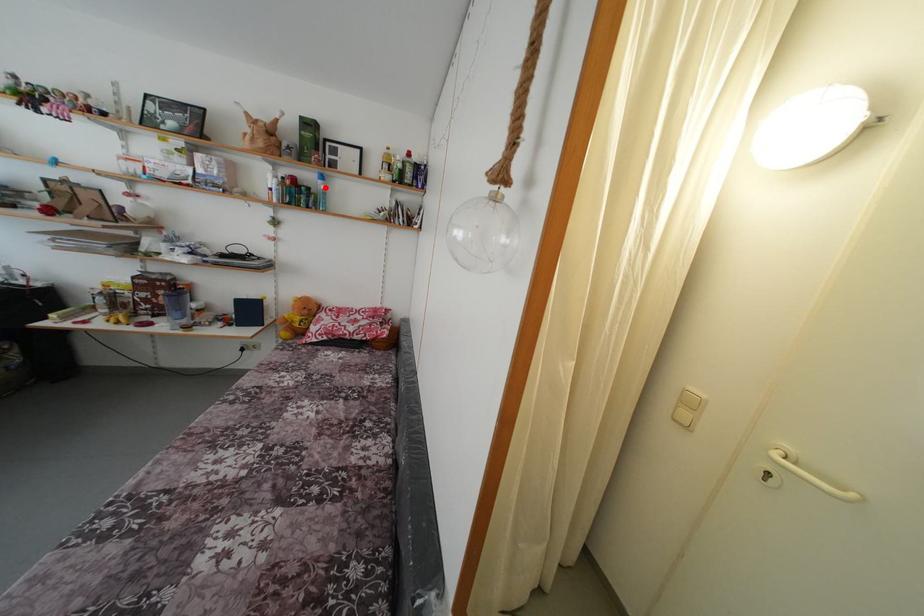
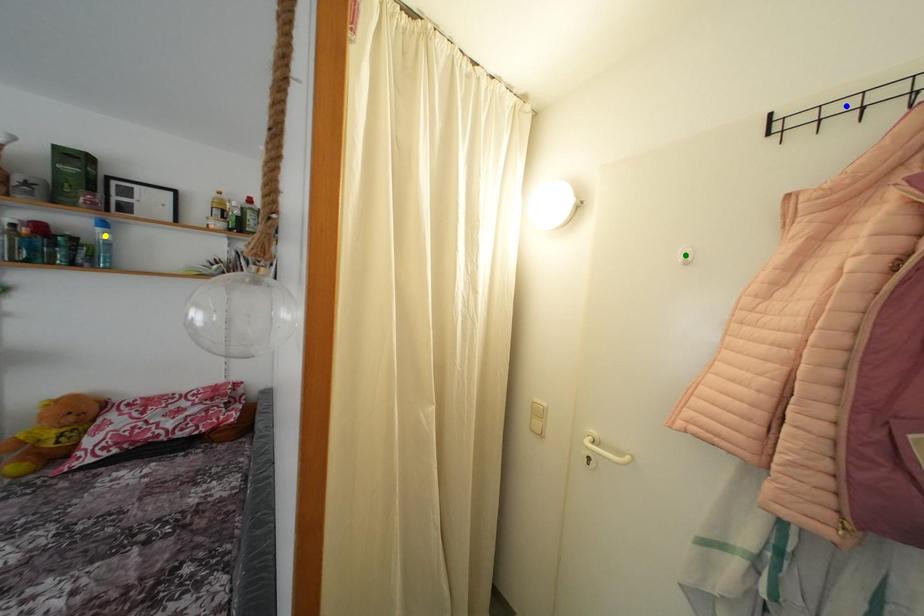
Question: I am providing you with two images of the same scene from different viewpoints. A red point is marked on the first image. You are given multiple points on the second image. Which spot in image 2 lines up with the point in image 1?

Choices:
 (A) green point
 (B) blue point
 (C) yellow point

Answer: (C)